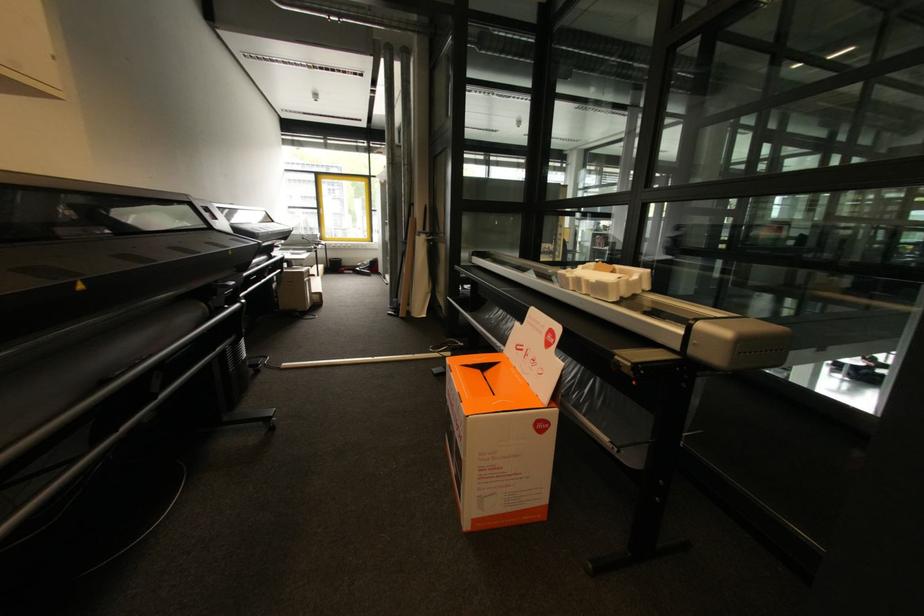
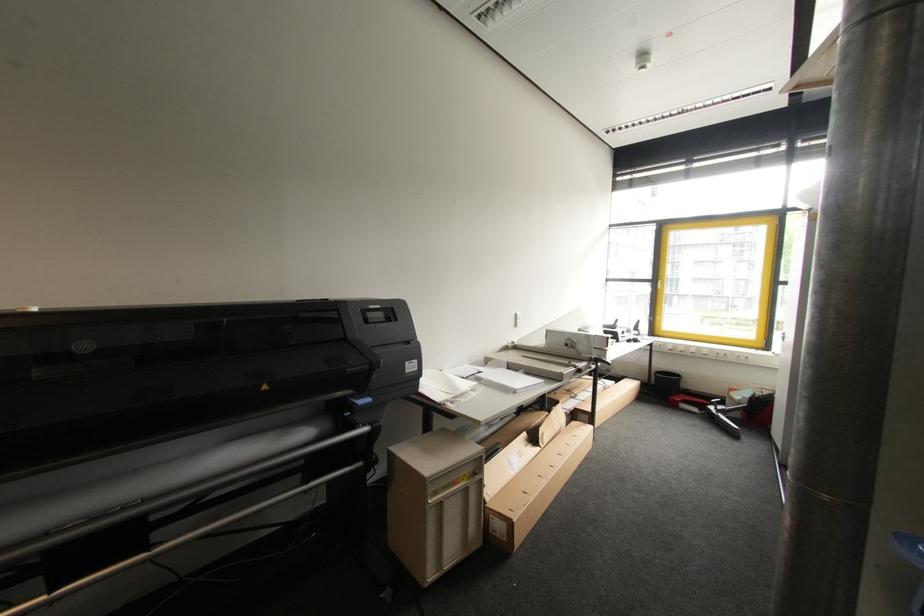
Locate, in the second image, the point that corresponds to the point at 321,297 in the first image.

(503, 527)